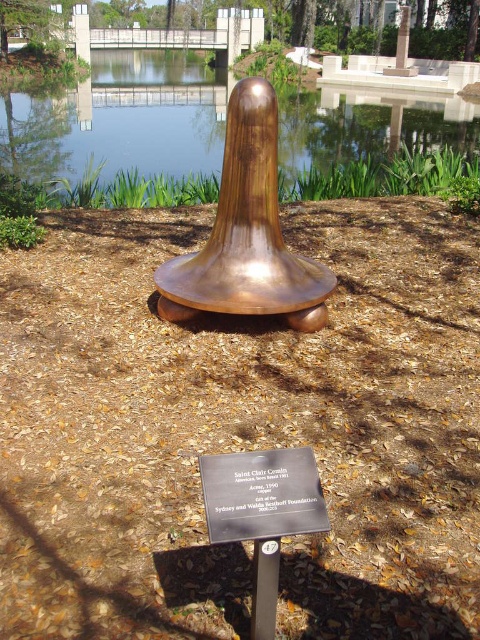
In the scene shown: Is copper polished sculpture at center in front of black metal plaque at center?

No, copper polished sculpture at center is further to the viewer.

Is copper polished sculpture at center taller than black metal plaque at center?

Yes, copper polished sculpture at center is taller than black metal plaque at center.

Describe the element at coordinates (247, 234) in the screenshot. I see `copper polished sculpture at center` at that location.

At what (x,y) coordinates should I click in order to perform the action: click on copper polished sculpture at center. Please return your answer as a coordinate pair (x, y). This screenshot has height=640, width=480. Looking at the image, I should click on (247, 234).

Between transparent glass water at center and copper polished sculpture at center, which one has less height?

copper polished sculpture at center is shorter.

Is transparent glass water at center below copper polished sculpture at center?

Actually, transparent glass water at center is above copper polished sculpture at center.

Is point (115, 125) in front of point (224, 224)?

No, (115, 125) is behind (224, 224).

The width and height of the screenshot is (480, 640). In order to click on transparent glass water at center in this screenshot , I will do `click(119, 120)`.

Between transparent glass water at center and black metal plaque at center, which one is positioned higher?

transparent glass water at center

Is point (379, 148) less distant than point (320, 518)?

That is False.

Where is `transparent glass water at center`? transparent glass water at center is located at coordinates (119, 120).